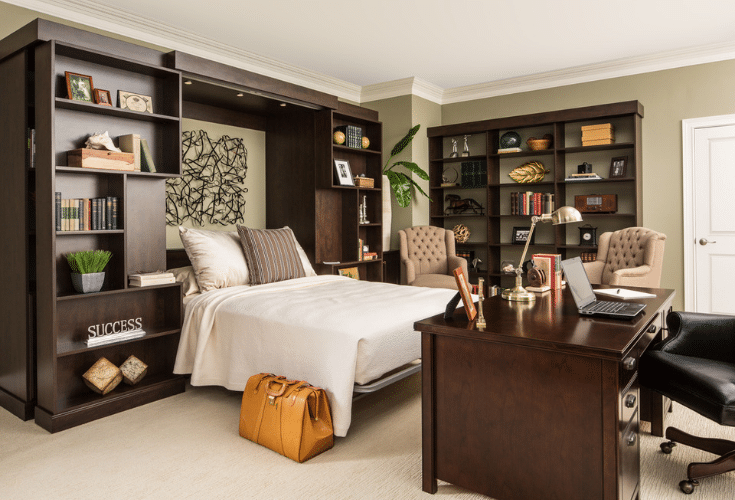
This screenshot has width=735, height=500. I want to click on white door, so click(x=691, y=182).